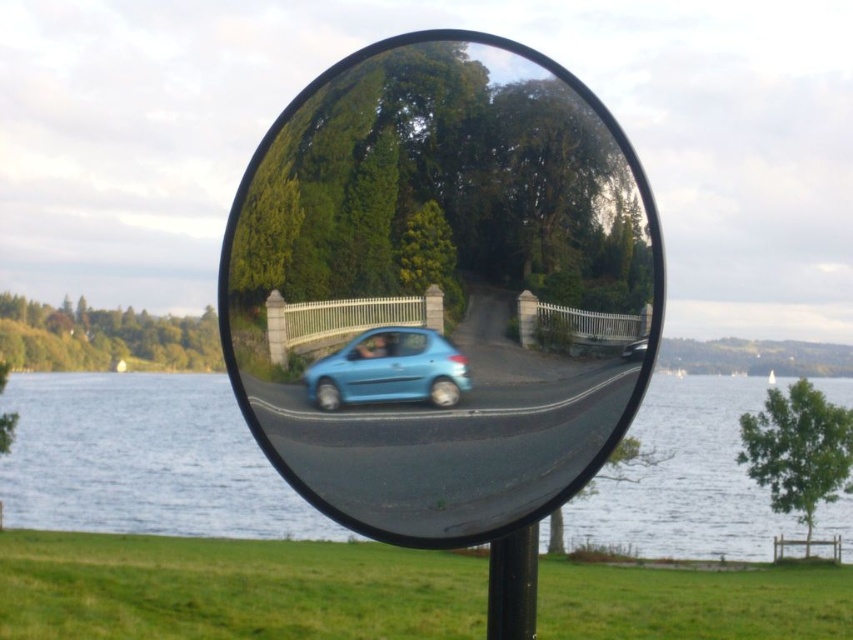
You are a driver approaching the convex traffic mirror on the road. You notice the smooth glass mirror at center and the blue water at mirror center in its reflection. Which object appears taller in the mirror?

The blue water at mirror center appears taller than the smooth glass mirror at center in the mirror reflection because the smooth glass mirror at center is shorter than blue water at mirror center.

You are standing in front of the smooth glass mirror at center. You want to take a photo of your reflection. The camera you have can only focus on objects within 1.5 meters. Will the mirror be in focus?

The smooth glass mirror at center is 1.46 meters away from you, which is within the camera focus range of 1.5 meters. Therefore, the mirror will be in focus.

You are a pedestrian standing near the convex traffic mirror. You see the blue water at mirror center and the light blue matte car at center in the reflection. Which object is positioned to the right side of the mirror?

The light blue matte car at center is positioned to the right side of the mirror because the blue water at mirror center is to the left of it.